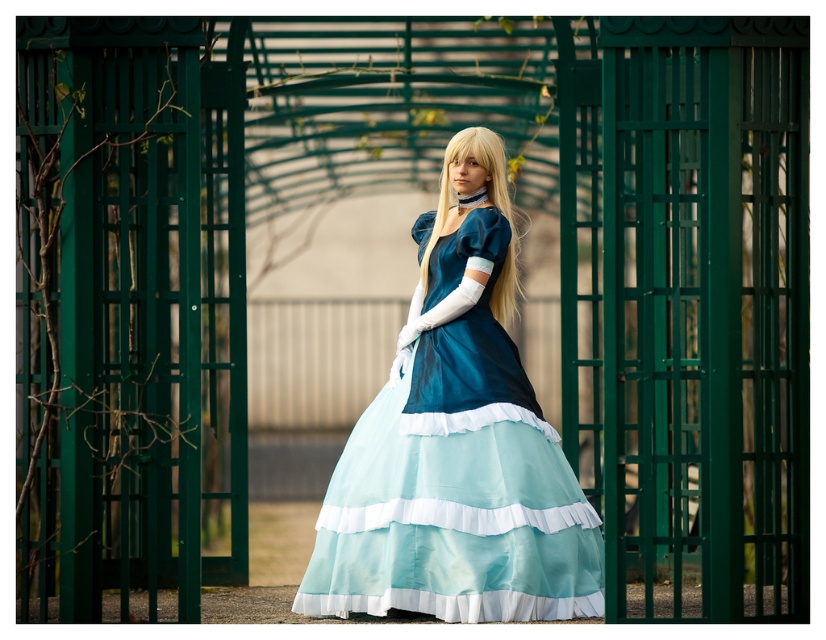
You are a photographer taking a portrait of the person in the Victorian costume. You need to ensure that the matte blue dress at center is fully visible in the photo. Is the blonde silky hair at center currently blocking any part of the dress?

The matte blue dress at center is positioned under blonde silky hair at center, so the hair is above the dress and not blocking it. The dress should be fully visible.

You are an artist sketching the scene and want to ensure proportions are accurate. Which object, the matte blue dress at center or the blonde silky hair at center, occupies more vertical space in the image?

The matte blue dress at center has a greater height compared to the blonde silky hair at center, so it occupies more vertical space in the image.